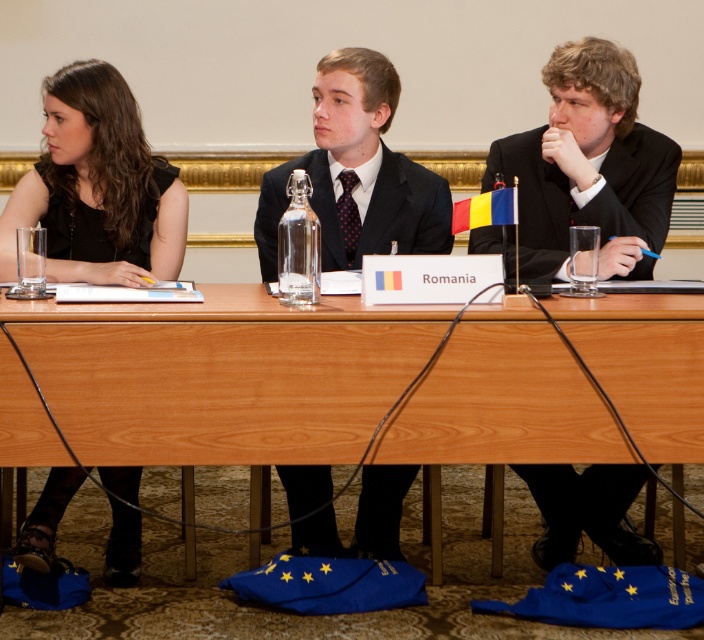
Question: Which of the following is the farthest from the observer?

Choices:
 (A) (46, 83)
 (B) (667, 211)
 (C) (341, 259)

Answer: (C)

Question: Is wooden table at center in front of black matte dress at left?

Choices:
 (A) no
 (B) yes

Answer: (B)

Question: Which point is farther to the camera?

Choices:
 (A) (106, 252)
 (B) (597, 113)

Answer: (A)

Question: Does black suit at center appear under black matte dress at left?

Choices:
 (A) no
 (B) yes

Answer: (A)

Question: Can you confirm if wooden table at center is smaller than black suit at center?

Choices:
 (A) no
 (B) yes

Answer: (A)

Question: Which point is closer to the camera?

Choices:
 (A) (30, 305)
 (B) (634, 136)
 (C) (44, 556)

Answer: (A)